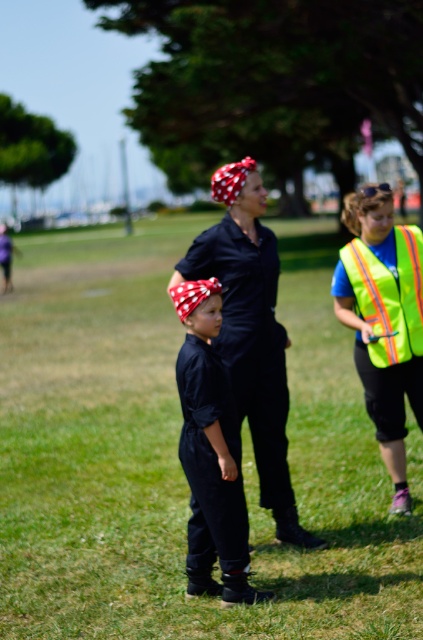
You are a drone operator trying to locate the matte black jumpsuit at center in a grassy field. Using the coordinate system where the bottom left corner is the origin, can you confirm if the jumpsuit is positioned closer to the upper half of the field?

The matte black jumpsuit at center is located at point [211,451], which is just below the midpoint of the vertical axis. Since the y coordinate is 0.499, it is very close to the center but slightly below, so it is in the lower half of the field.

You are a fashion designer observing the scene. You notice two items at the center of the image, the matte black shirt at center and the matte black jumpsuit at center. Which one has a greater horizontal spread when viewed from the front?

The matte black shirt at center has a greater horizontal spread than the matte black jumpsuit at center, as its width surpasses that of the jumpsuit.

You are a drone operator trying to capture a clear aerial photo of the green grass at center and the neon yellow reflective safety vest at right. Based on their positions, which object should you focus on first to ensure both are in frame?

The green grass at center is located above the neon yellow reflective safety vest at right, so you should focus on the neon yellow reflective safety vest at right first to ensure both are in frame.